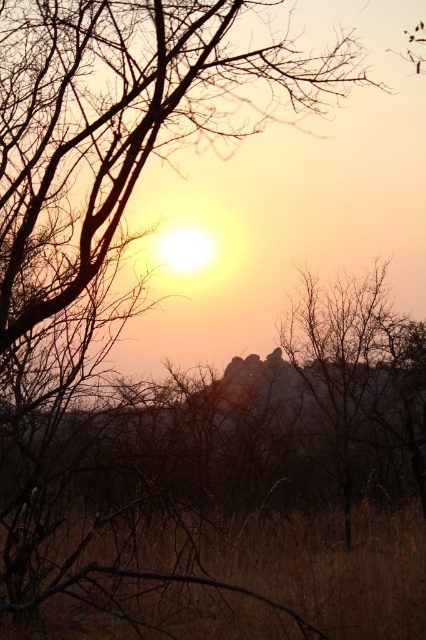
Consider the image. Between brown dry grass at lower center and brown textured tree at center, which one is positioned lower?

brown dry grass at lower center is lower down.

Based on the photo, is brown dry grass at lower center below brown textured tree at center?

Correct, brown dry grass at lower center is located below brown textured tree at center.

Is point (5, 630) in front of point (313, 332)?

Yes.

The height and width of the screenshot is (640, 426). I want to click on brown dry grass at lower center, so click(x=331, y=568).